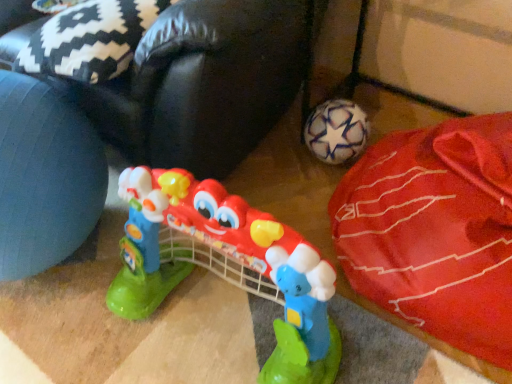
Question: Is red fabric bean bag at lower right outside of white matte soccer ball at lower right?

Choices:
 (A) no
 (B) yes

Answer: (B)

Question: Considering the relative sizes of red fabric bean bag at lower right and white matte soccer ball at lower right in the image provided, is red fabric bean bag at lower right bigger than white matte soccer ball at lower right?

Choices:
 (A) yes
 (B) no

Answer: (A)

Question: Does red fabric bean bag at lower right appear on the right side of white matte soccer ball at lower right?

Choices:
 (A) yes
 (B) no

Answer: (B)

Question: From the image's perspective, would you say red fabric bean bag at lower right is positioned over white matte soccer ball at lower right?

Choices:
 (A) no
 (B) yes

Answer: (B)

Question: Is red fabric bean bag at lower right oriented towards white matte soccer ball at lower right?

Choices:
 (A) no
 (B) yes

Answer: (A)

Question: Is the depth of red fabric bean bag at lower right less than that of white matte soccer ball at lower right?

Choices:
 (A) no
 (B) yes

Answer: (A)

Question: Is plastic toy guitar at center behind red fabric bean bag at lower right?

Choices:
 (A) yes
 (B) no

Answer: (B)

Question: Is plastic toy guitar at center positioned far away from red fabric bean bag at lower right?

Choices:
 (A) no
 (B) yes

Answer: (A)

Question: Is plastic toy guitar at center wider than red fabric bean bag at lower right?

Choices:
 (A) no
 (B) yes

Answer: (A)

Question: Can red fabric bean bag at lower right be found inside plastic toy guitar at center?

Choices:
 (A) yes
 (B) no

Answer: (B)

Question: Is plastic toy guitar at center placed right next to red fabric bean bag at lower right?

Choices:
 (A) yes
 (B) no

Answer: (B)

Question: From the image's perspective, would you say plastic toy guitar at center is positioned over red fabric bean bag at lower right?

Choices:
 (A) no
 (B) yes

Answer: (A)

Question: Is plastic toy guitar at center located within white matte soccer ball at lower right?

Choices:
 (A) yes
 (B) no

Answer: (B)